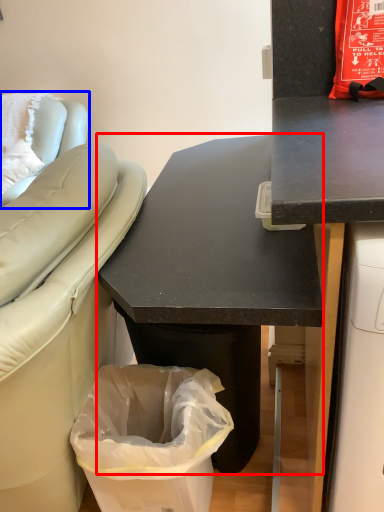
Question: Which object appears farthest to the camera in this image, desk (highlighted by a red box) or furniture (highlighted by a blue box)?

Choices:
 (A) desk
 (B) furniture

Answer: (B)